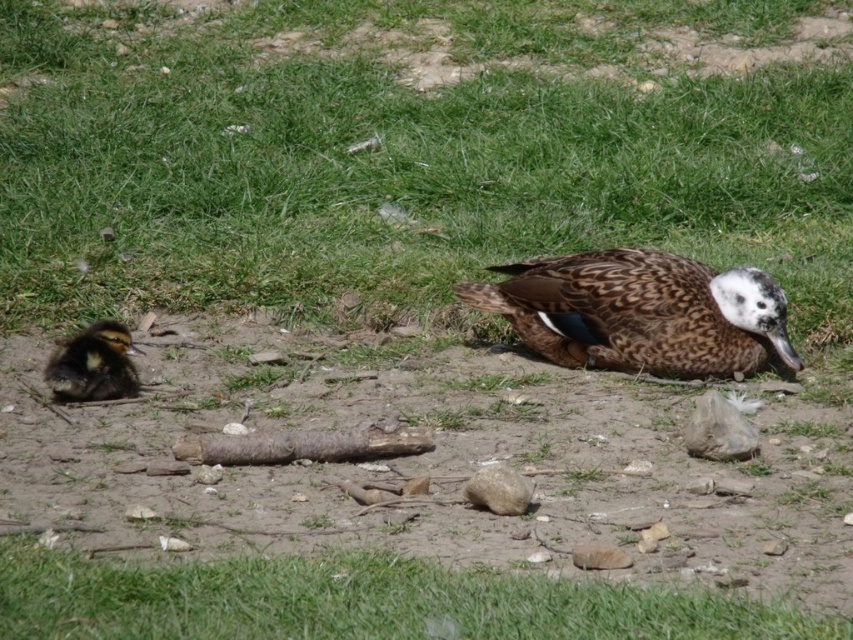
Who is more distant from viewer, (811,632) or (131,349)?

Point (131,349)

Between point (194, 609) and point (111, 378), which one is positioned in front?

Point (194, 609)

Who is more distant from viewer, (154, 618) or (86, 360)?

The point (86, 360) is more distant.

I want to click on green grass at lower center, so click(361, 602).

Does brown speckled duck at center appear on the left side of brown fluffy duckling at left?

Incorrect, brown speckled duck at center is not on the left side of brown fluffy duckling at left.

Who is higher up, brown speckled duck at center or brown fluffy duckling at left?

brown speckled duck at center is above.

Locate an element on the screen. Image resolution: width=853 pixels, height=640 pixels. brown speckled duck at center is located at coordinates (640, 312).

You are a GUI agent. You are given a task and a screenshot of the screen. Output one action in this format:
    pyautogui.click(x=<x>, y=<y>)
    Task: Click on the brown speckled duck at center
    This screenshot has height=640, width=853.
    Given the screenshot: What is the action you would take?
    tap(640, 312)

Looking at this image, can you confirm if green grass at lower center is positioned above brown speckled duck at center?

Incorrect, green grass at lower center is not positioned above brown speckled duck at center.

Is green grass at lower center bigger than brown speckled duck at center?

Incorrect, green grass at lower center is not larger than brown speckled duck at center.

Where is `green grass at lower center`? The image size is (853, 640). green grass at lower center is located at coordinates (361, 602).